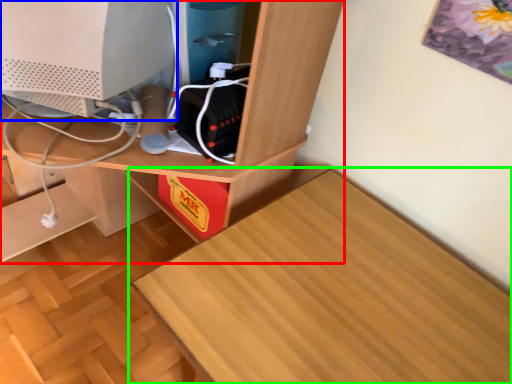
Question: Considering the real-world distances, which object is closest to desk (highlighted by a red box)? computer monitor (highlighted by a blue box) or table (highlighted by a green box).

Choices:
 (A) computer monitor
 (B) table

Answer: (A)